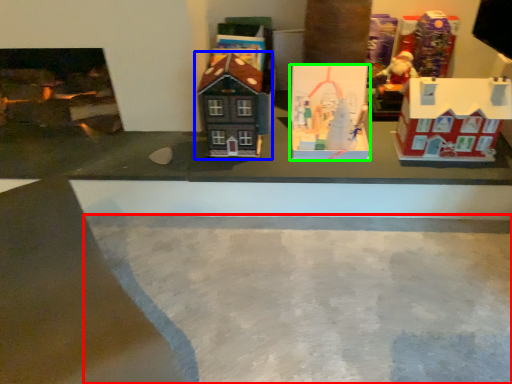
Question: Which object is positioned closest to concrete (highlighted by a red box)? Select from toy (highlighted by a blue box) and toy (highlighted by a green box).

Choices:
 (A) toy
 (B) toy

Answer: (B)